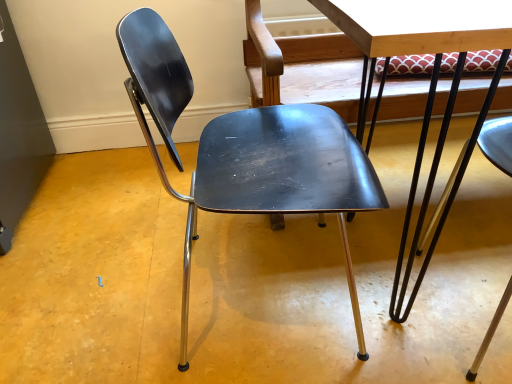
The height and width of the screenshot is (384, 512). Describe the element at coordinates (247, 152) in the screenshot. I see `matte black chair at center` at that location.

The image size is (512, 384). I want to click on matte black chair at center, so click(247, 152).

What is the approximate height of matte black chair at center?

It is 28.18 inches.

Describe the element at coordinates (430, 84) in the screenshot. This screenshot has width=512, height=384. I see `metallic/smooth table at center` at that location.

Locate an element on the screen. The image size is (512, 384). metallic/smooth table at center is located at coordinates (430, 84).

Where is `matte black chair at center`? The image size is (512, 384). matte black chair at center is located at coordinates (247, 152).

Consider the image. Considering the relative positions of matte black chair at center and metallic/smooth table at center in the image provided, is matte black chair at center to the left or to the right of metallic/smooth table at center?

matte black chair at center is positioned on metallic/smooth table at center's left side.

In the scene shown: Is matte black chair at center closer to the viewer compared to metallic/smooth table at center?

No, matte black chair at center is further to the viewer.

Based on the photo, which is less distant, (284, 171) or (379, 93)?

Clearly, point (284, 171) is closer to the camera than point (379, 93).

From the image's perspective, is matte black chair at center above or below metallic/smooth table at center?

matte black chair at center is situated lower than metallic/smooth table at center in the image.

From a real-world perspective, which object rests below the other?

matte black chair at center is physically lower.

Considering the relative sizes of matte black chair at center and metallic/smooth table at center in the image provided, is matte black chair at center wider than metallic/smooth table at center?

No.

In terms of height, does matte black chair at center look taller or shorter compared to metallic/smooth table at center?

matte black chair at center is shorter than metallic/smooth table at center.

Is matte black chair at center bigger than metallic/smooth table at center?

Actually, matte black chair at center might be smaller than metallic/smooth table at center.

Is matte black chair at center spatially inside metallic/smooth table at center, or outside of it?

matte black chair at center is located beyond the bounds of metallic/smooth table at center.

Is matte black chair at center not close to metallic/smooth table at center?

They are positioned close to each other.

Consider the image. Does matte black chair at center turn towards metallic/smooth table at center?

Yes, matte black chair at center is turned towards metallic/smooth table at center.

Consider the image. How different are the orientations of matte black chair at center and metallic/smooth table at center in degrees?

Answer: matte black chair at center and metallic/smooth table at center are facing 90 degrees away from each other.

Locate an element on the screen. chair behind the metallic/smooth table at center is located at coordinates 247,152.

Is metallic/smooth table at center at the left side of matte black chair at center?

No.

Is metallic/smooth table at center positioned in front of matte black chair at center?

Yes, metallic/smooth table at center is closer to the camera.

Is point (458, 34) behind point (343, 210)?

No, it is not.

From the image's perspective, is metallic/smooth table at center under matte black chair at center?

No.

From a real-world perspective, is metallic/smooth table at center physically above matte black chair at center?

Yes, from a real-world perspective, metallic/smooth table at center is on top of matte black chair at center.

In the scene shown: Which object is thinner, metallic/smooth table at center or matte black chair at center?

With smaller width is matte black chair at center.

Can you confirm if metallic/smooth table at center is taller than matte black chair at center?

Correct, metallic/smooth table at center is much taller as matte black chair at center.

Considering the sizes of objects metallic/smooth table at center and matte black chair at center in the image provided, who is smaller, metallic/smooth table at center or matte black chair at center?

matte black chair at center is smaller.

Is metallic/smooth table at center positioned beyond the bounds of matte black chair at center?

Yes, metallic/smooth table at center is located beyond the bounds of matte black chair at center.

Is metallic/smooth table at center far from matte black chair at center?

No, metallic/smooth table at center is not far away from matte black chair at center.

Is metallic/smooth table at center oriented away from matte black chair at center?

No.

How different are the orientations of metallic/smooth table at center and matte black chair at center in degrees?

The angle between the facing direction of metallic/smooth table at center and the facing direction of matte black chair at center is 90 degrees.

Where is `chair below the metallic/smooth table at center (from the image's perspective)`? Image resolution: width=512 pixels, height=384 pixels. chair below the metallic/smooth table at center (from the image's perspective) is located at coordinates (247, 152).

Image resolution: width=512 pixels, height=384 pixels. In the image, there is a metallic/smooth table at center. What are the coordinates of `chair below it (from the image's perspective)` in the screenshot? It's located at (247, 152).

At what (x,y) coordinates should I click in order to perform the action: click on table above the matte black chair at center (from the image's perspective). Please return your answer as a coordinate pair (x, y). The image size is (512, 384). Looking at the image, I should click on (430, 84).